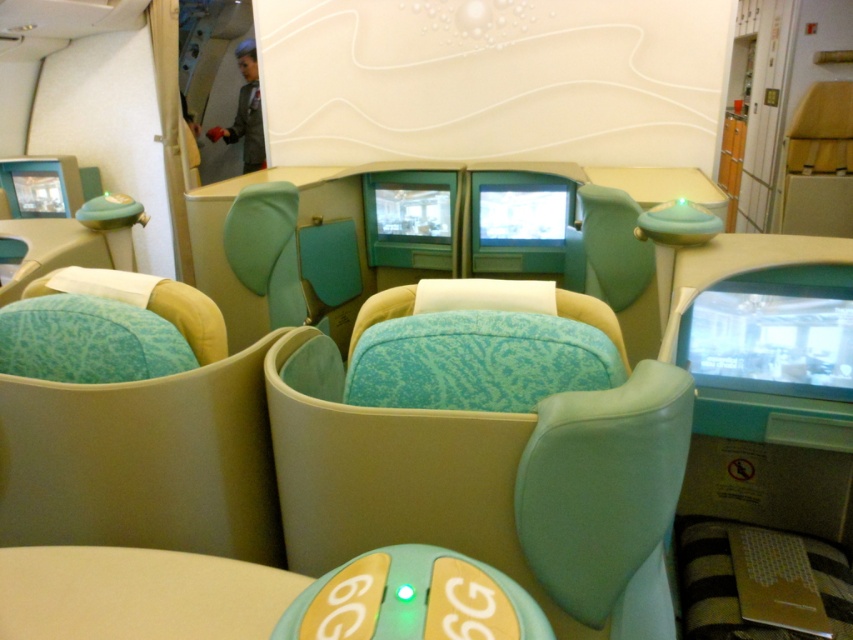
In the scene shown: You are an airline attendant checking seat dimensions for passengers. You notice two seats at the center labeled as turquoise fabric seat at center and teal fabric seat at center. Which seat has a wider seating area?

The turquoise fabric seat at center has a wider seating area than the teal fabric seat at center according to the description.

You are a flight attendant checking the seating arrangement. You notice two seats labeled turquoise fabric seat at center and teal fabric seat at center. Which seat is located below the other?

The turquoise fabric seat at center is positioned under the teal fabric seat at center, meaning it is located below the teal fabric seat at center.